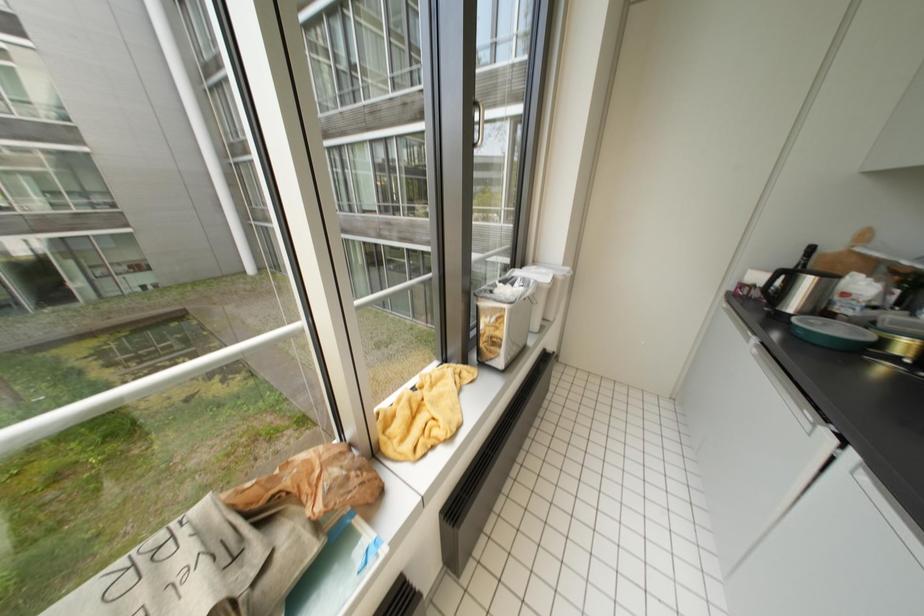
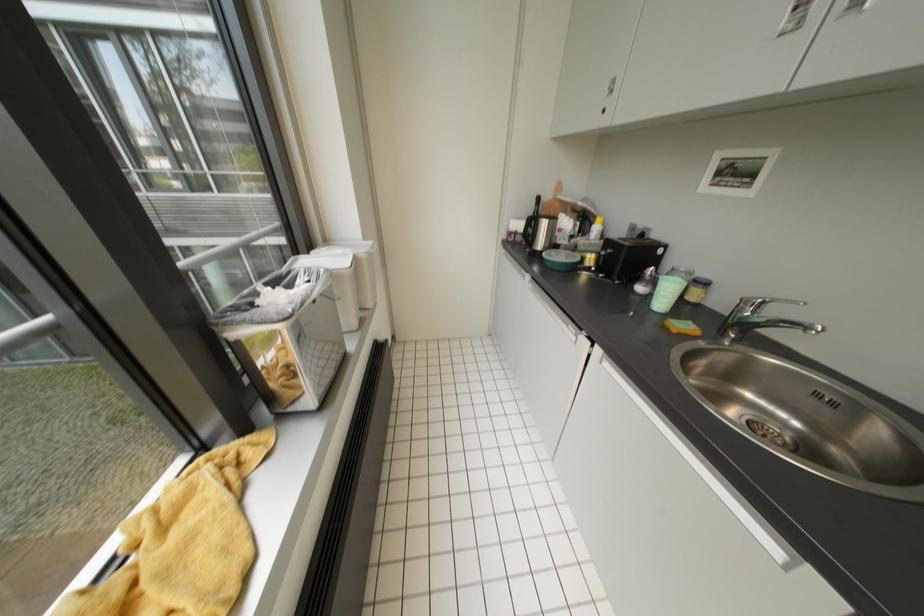
Question: Based on the continuous images, in which direction is the camera rotating? Reply with the corresponding letter.

Choices:
 (A) Left
 (B) Right
 (C) Up
 (D) Down

Answer: (B)